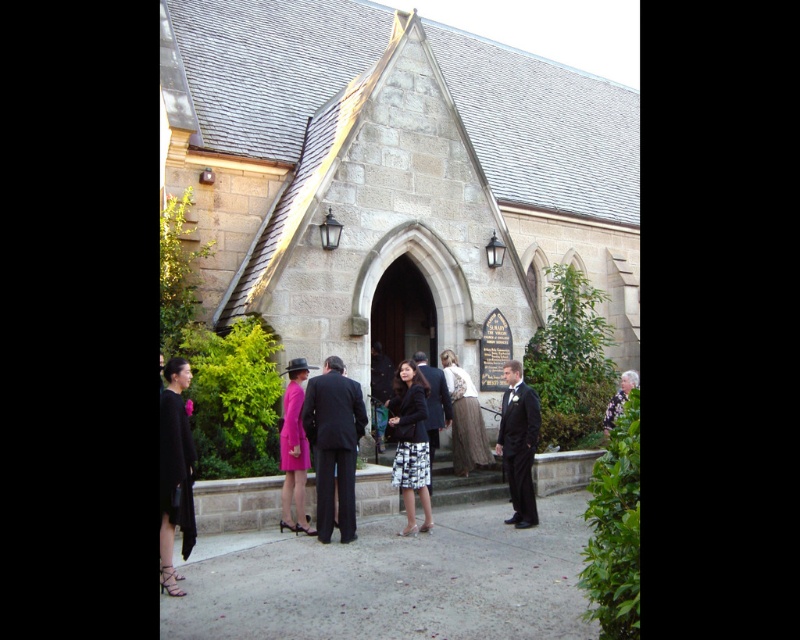
Question: Which point is closer to the camera?

Choices:
 (A) stone church at center
 (B) matte pink dress at center

Answer: (B)

Question: Does stone church at center lie behind matte pink dress at center?

Choices:
 (A) no
 (B) yes

Answer: (B)

Question: Based on their relative distances, which object is farther from the black and white printed skirt at center?

Choices:
 (A) black textured blazer at center
 (B) black suit at center

Answer: (B)

Question: Is stone church at center positioned behind matte black suit at center?

Choices:
 (A) no
 (B) yes

Answer: (B)

Question: Does shiny black suit at center have a larger size compared to black and white printed skirt at center?

Choices:
 (A) no
 (B) yes

Answer: (A)

Question: Which is nearer to the black and white printed skirt at center?

Choices:
 (A) matte pink dress at center
 (B) white lace blouse at center

Answer: (A)